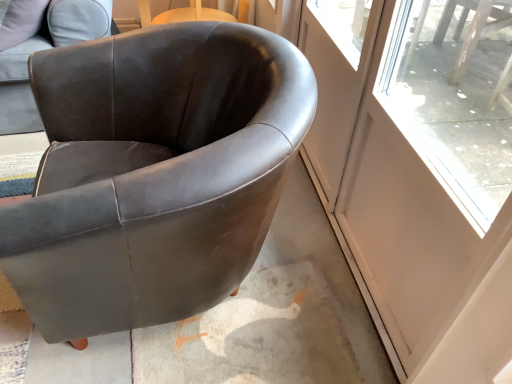
You are a GUI agent. You are given a task and a screenshot of the screen. Output one action in this format:
    pyautogui.click(x=<x>, y=<y>)
    Task: Click on the transparent glass screen door at right, which appears as the 2th screen door when viewed from the left
    This screenshot has width=512, height=384.
    Given the screenshot: What is the action you would take?
    (419, 172)

This screenshot has height=384, width=512. What do you see at coordinates (44, 49) in the screenshot? I see `suede-like brown armchair at upper left, arranged as the 2th chair when viewed from the right` at bounding box center [44, 49].

This screenshot has width=512, height=384. What are the coordinates of `matte black armchair at center, the first chair in the right-to-left sequence` in the screenshot? It's located at (154, 173).

Looking at this image, is matte black armchair at center, positioned as the second chair in left-to-right order, wider or thinner than clear glass screen door at upper right, marked as the 1th screen door in a left-to-right arrangement?

In the image, matte black armchair at center, positioned as the second chair in left-to-right order, appears to be wider than clear glass screen door at upper right, marked as the 1th screen door in a left-to-right arrangement.

Are matte black armchair at center, the first chair in the right-to-left sequence, and clear glass screen door at upper right, marked as the 1th screen door in a left-to-right arrangement, located far from each other?

No, matte black armchair at center, the first chair in the right-to-left sequence, is not far away from clear glass screen door at upper right, marked as the 1th screen door in a left-to-right arrangement.

Considering the positions of objects matte black armchair at center, positioned as the second chair in left-to-right order, and clear glass screen door at upper right, marked as the 1th screen door in a left-to-right arrangement, in the image provided, who is in front, matte black armchair at center, positioned as the second chair in left-to-right order, or clear glass screen door at upper right, marked as the 1th screen door in a left-to-right arrangement,?

matte black armchair at center, positioned as the second chair in left-to-right order, is closer to the camera.

From the image's perspective, is matte black armchair at center, the first chair in the right-to-left sequence, located above clear glass screen door at upper right, the 2th screen door in the right-to-left sequence?

No, from the image's perspective, matte black armchair at center, the first chair in the right-to-left sequence, is not above clear glass screen door at upper right, the 2th screen door in the right-to-left sequence.

Locate an element on the screen. The height and width of the screenshot is (384, 512). screen door above the clear glass screen door at upper right, the 2th screen door in the right-to-left sequence (from a real-world perspective) is located at coordinates (419, 172).

Which of these two, transparent glass screen door at right, which appears as the 2th screen door when viewed from the left, or clear glass screen door at upper right, the 2th screen door in the right-to-left sequence, is bigger?

Bigger between the two is transparent glass screen door at right, which appears as the 2th screen door when viewed from the left.

Can you tell me how much transparent glass screen door at right, the first screen door in the right-to-left sequence, and clear glass screen door at upper right, marked as the 1th screen door in a left-to-right arrangement, differ in facing direction?

transparent glass screen door at right, the first screen door in the right-to-left sequence, and clear glass screen door at upper right, marked as the 1th screen door in a left-to-right arrangement, are facing 0.0012 degrees away from each other.

In the scene shown: Would you say clear glass screen door at upper right, marked as the 1th screen door in a left-to-right arrangement, is part of transparent glass screen door at right, which appears as the 2th screen door when viewed from the left,'s contents?

No, clear glass screen door at upper right, marked as the 1th screen door in a left-to-right arrangement, is not a part of transparent glass screen door at right, which appears as the 2th screen door when viewed from the left.

At what (x,y) coordinates should I click in order to perform the action: click on chair that is under the clear glass screen door at upper right, marked as the 1th screen door in a left-to-right arrangement (from a real-world perspective). Please return your answer as a coordinate pair (x, y). The height and width of the screenshot is (384, 512). Looking at the image, I should click on (154, 173).

Considering the points (331, 106) and (136, 199), which point is in front, point (331, 106) or point (136, 199)?

Point (136, 199)

Which of these two, clear glass screen door at upper right, marked as the 1th screen door in a left-to-right arrangement, or matte black armchair at center, the first chair in the right-to-left sequence, is wider?

matte black armchair at center, the first chair in the right-to-left sequence, is wider.

Is clear glass screen door at upper right, marked as the 1th screen door in a left-to-right arrangement, taller than matte black armchair at center, the first chair in the right-to-left sequence?

Yes, clear glass screen door at upper right, marked as the 1th screen door in a left-to-right arrangement, is taller than matte black armchair at center, the first chair in the right-to-left sequence.

From the image's perspective, who appears lower, clear glass screen door at upper right, marked as the 1th screen door in a left-to-right arrangement, or suede-like brown armchair at upper left, arranged as the 2th chair when viewed from the right?

clear glass screen door at upper right, marked as the 1th screen door in a left-to-right arrangement, is shown below in the image.

Is clear glass screen door at upper right, the 2th screen door in the right-to-left sequence, far from suede-like brown armchair at upper left, arranged as the 2th chair when viewed from the right?

clear glass screen door at upper right, the 2th screen door in the right-to-left sequence, is positioned a significant distance from suede-like brown armchair at upper left, arranged as the 2th chair when viewed from the right.

How distant is clear glass screen door at upper right, the 2th screen door in the right-to-left sequence, from suede-like brown armchair at upper left, arranged as the 2th chair when viewed from the right?

clear glass screen door at upper right, the 2th screen door in the right-to-left sequence, and suede-like brown armchair at upper left, arranged as the 2th chair when viewed from the right, are 3.35 feet apart.

Do you think clear glass screen door at upper right, the 2th screen door in the right-to-left sequence, is within suede-like brown armchair at upper left, which is the first chair in left-to-right order, or outside of it?

clear glass screen door at upper right, the 2th screen door in the right-to-left sequence, lies outside suede-like brown armchair at upper left, which is the first chair in left-to-right order.

Would you say suede-like brown armchair at upper left, arranged as the 2th chair when viewed from the right, is inside or outside clear glass screen door at upper right, the 2th screen door in the right-to-left sequence?

suede-like brown armchair at upper left, arranged as the 2th chair when viewed from the right, is not enclosed by clear glass screen door at upper right, the 2th screen door in the right-to-left sequence.

Is suede-like brown armchair at upper left, which is the first chair in left-to-right order, positioned far away from clear glass screen door at upper right, marked as the 1th screen door in a left-to-right arrangement?

Yes, suede-like brown armchair at upper left, which is the first chair in left-to-right order, and clear glass screen door at upper right, marked as the 1th screen door in a left-to-right arrangement, are located far from each other.

Does suede-like brown armchair at upper left, arranged as the 2th chair when viewed from the right, appear on the right side of clear glass screen door at upper right, marked as the 1th screen door in a left-to-right arrangement?

Incorrect, suede-like brown armchair at upper left, arranged as the 2th chair when viewed from the right, is not on the right side of clear glass screen door at upper right, marked as the 1th screen door in a left-to-right arrangement.

In the image, there is a clear glass screen door at upper right, the 2th screen door in the right-to-left sequence. Identify the location of chair above it (from the image's perspective). Image resolution: width=512 pixels, height=384 pixels. (44, 49).

Which is in front, point (418, 296) or point (193, 109)?

The point (418, 296) is in front.

From a real-world perspective, who is located higher, transparent glass screen door at right, which appears as the 2th screen door when viewed from the left, or matte black armchair at center, positioned as the second chair in left-to-right order?

In real-world perspective, transparent glass screen door at right, which appears as the 2th screen door when viewed from the left, is above.

Considering the relative positions of transparent glass screen door at right, the first screen door in the right-to-left sequence, and matte black armchair at center, positioned as the second chair in left-to-right order, in the image provided, is transparent glass screen door at right, the first screen door in the right-to-left sequence, to the right of matte black armchair at center, positioned as the second chair in left-to-right order, from the viewer's perspective?

Yes, transparent glass screen door at right, the first screen door in the right-to-left sequence, is to the right of matte black armchair at center, positioned as the second chair in left-to-right order.

Considering the relative sizes of transparent glass screen door at right, which appears as the 2th screen door when viewed from the left, and matte black armchair at center, positioned as the second chair in left-to-right order, in the image provided, is transparent glass screen door at right, which appears as the 2th screen door when viewed from the left, smaller than matte black armchair at center, positioned as the second chair in left-to-right order,?

Yes, transparent glass screen door at right, which appears as the 2th screen door when viewed from the left, is smaller than matte black armchair at center, positioned as the second chair in left-to-right order.

From a real-world perspective, is matte black armchair at center, positioned as the second chair in left-to-right order, located beneath suede-like brown armchair at upper left, arranged as the 2th chair when viewed from the right?

Yes.

In terms of size, does matte black armchair at center, positioned as the second chair in left-to-right order, appear bigger or smaller than suede-like brown armchair at upper left, which is the first chair in left-to-right order?

matte black armchair at center, positioned as the second chair in left-to-right order, is bigger than suede-like brown armchair at upper left, which is the first chair in left-to-right order.

Is matte black armchair at center, the first chair in the right-to-left sequence, oriented away from suede-like brown armchair at upper left, which is the first chair in left-to-right order?

That's not correct — matte black armchair at center, the first chair in the right-to-left sequence, is not looking away from suede-like brown armchair at upper left, which is the first chair in left-to-right order.

Is suede-like brown armchair at upper left, arranged as the 2th chair when viewed from the right, a part of matte black armchair at center, positioned as the second chair in left-to-right order?

No, suede-like brown armchair at upper left, arranged as the 2th chair when viewed from the right, is not inside matte black armchair at center, positioned as the second chair in left-to-right order.

Find the location of a particular element. The image size is (512, 384). screen door above the matte black armchair at center, the first chair in the right-to-left sequence (from the image's perspective) is located at coordinates (336, 79).

The height and width of the screenshot is (384, 512). I want to click on screen door behind the transparent glass screen door at right, which appears as the 2th screen door when viewed from the left, so click(x=336, y=79).

Based on their spatial positions, is matte black armchair at center, positioned as the second chair in left-to-right order, or clear glass screen door at upper right, marked as the 1th screen door in a left-to-right arrangement, closer to suede-like brown armchair at upper left, which is the first chair in left-to-right order?

Among the two, matte black armchair at center, positioned as the second chair in left-to-right order, is located nearer to suede-like brown armchair at upper left, which is the first chair in left-to-right order.

Considering their positions, is clear glass screen door at upper right, marked as the 1th screen door in a left-to-right arrangement, positioned closer to matte black armchair at center, positioned as the second chair in left-to-right order, than suede-like brown armchair at upper left, arranged as the 2th chair when viewed from the right?

clear glass screen door at upper right, marked as the 1th screen door in a left-to-right arrangement, lies closer to matte black armchair at center, positioned as the second chair in left-to-right order, than the other object.

Estimate the real-world distances between objects in this image. Which object is further from transparent glass screen door at right, the first screen door in the right-to-left sequence, clear glass screen door at upper right, marked as the 1th screen door in a left-to-right arrangement, or matte black armchair at center, positioned as the second chair in left-to-right order?

matte black armchair at center, positioned as the second chair in left-to-right order, lies further to transparent glass screen door at right, the first screen door in the right-to-left sequence, than the other object.

Estimate the real-world distances between objects in this image. Which object is closer to clear glass screen door at upper right, the 2th screen door in the right-to-left sequence, suede-like brown armchair at upper left, which is the first chair in left-to-right order, or transparent glass screen door at right, the first screen door in the right-to-left sequence?

transparent glass screen door at right, the first screen door in the right-to-left sequence.

In the scene shown: Which object lies nearer to the anchor point suede-like brown armchair at upper left, arranged as the 2th chair when viewed from the right, clear glass screen door at upper right, marked as the 1th screen door in a left-to-right arrangement, or transparent glass screen door at right, which appears as the 2th screen door when viewed from the left?

Among the two, clear glass screen door at upper right, marked as the 1th screen door in a left-to-right arrangement, is located nearer to suede-like brown armchair at upper left, arranged as the 2th chair when viewed from the right.

Looking at this image, looking at the image, which one is located closer to suede-like brown armchair at upper left, which is the first chair in left-to-right order, transparent glass screen door at right, which appears as the 2th screen door when viewed from the left, or matte black armchair at center, the first chair in the right-to-left sequence?

matte black armchair at center, the first chair in the right-to-left sequence, is positioned closer to the anchor suede-like brown armchair at upper left, which is the first chair in left-to-right order.

Estimate the real-world distances between objects in this image. Which object is closer to matte black armchair at center, positioned as the second chair in left-to-right order, suede-like brown armchair at upper left, which is the first chair in left-to-right order, or clear glass screen door at upper right, the 2th screen door in the right-to-left sequence?

clear glass screen door at upper right, the 2th screen door in the right-to-left sequence.

Which object lies further to the anchor point clear glass screen door at upper right, marked as the 1th screen door in a left-to-right arrangement, transparent glass screen door at right, which appears as the 2th screen door when viewed from the left, or matte black armchair at center, the first chair in the right-to-left sequence?

transparent glass screen door at right, which appears as the 2th screen door when viewed from the left, is further to clear glass screen door at upper right, marked as the 1th screen door in a left-to-right arrangement.

Locate an element on the screen. screen door between suede-like brown armchair at upper left, arranged as the 2th chair when viewed from the right, and transparent glass screen door at right, which appears as the 2th screen door when viewed from the left, in the horizontal direction is located at coordinates (336, 79).

The image size is (512, 384). I want to click on screen door between matte black armchair at center, the first chair in the right-to-left sequence, and transparent glass screen door at right, which appears as the 2th screen door when viewed from the left, in the horizontal direction, so click(336, 79).

Where is `chair situated between suede-like brown armchair at upper left, arranged as the 2th chair when viewed from the right, and transparent glass screen door at right, which appears as the 2th screen door when viewed from the left, from left to right`? The image size is (512, 384). chair situated between suede-like brown armchair at upper left, arranged as the 2th chair when viewed from the right, and transparent glass screen door at right, which appears as the 2th screen door when viewed from the left, from left to right is located at coordinates (154, 173).

Locate an element on the screen. chair between suede-like brown armchair at upper left, arranged as the 2th chair when viewed from the right, and clear glass screen door at upper right, marked as the 1th screen door in a left-to-right arrangement, in the horizontal direction is located at coordinates (154, 173).